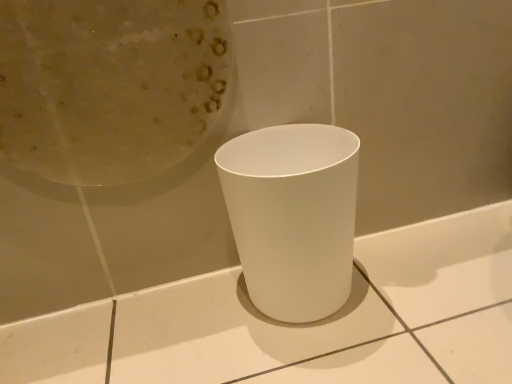
You are a GUI agent. You are given a task and a screenshot of the screen. Output one action in this format:
    pyautogui.click(x=<x>, y=<y>)
    Task: Click on the vacant space positioned to the left of white matte vase at center
    This screenshot has height=384, width=512.
    Given the screenshot: What is the action you would take?
    pyautogui.click(x=189, y=319)